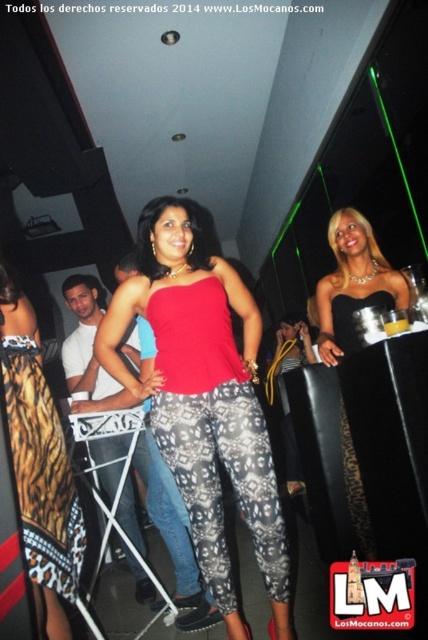
You are a photographer at the party and want to capture both the matte red tank top at center and the black satin dress at center in a single frame. Which clothing item should you focus on first to ensure both are fully visible in the photo?

The matte red tank top at center is wider than the black satin dress at center, so you should focus on the matte red tank top at center first to ensure both are fully visible in the photo.

You are organizing a clothing display and need to arrange the matte red tank top at center and the black satin dress at center in a limited space. Which item should you choose to fit better in a smaller display area?

The matte red tank top at center occupies less space than the black satin dress at center, so it would fit better in a smaller display area.

You are at a party and want to take a photo of the printed fabric skirt at lower left and the black satin dress at center. Which one should you focus on first to ensure both are in focus?

The printed fabric skirt at lower left is closer to the viewer than the black satin dress at center, so you should focus on the printed fabric skirt at lower left first to ensure both are in focus.